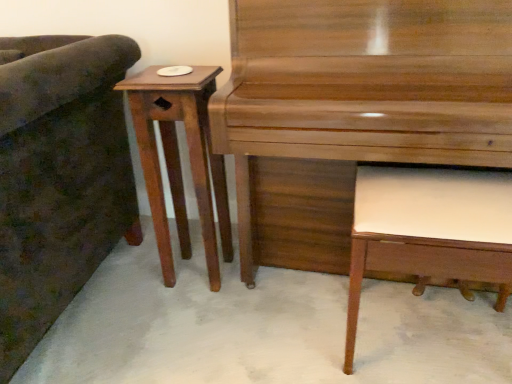
Question: Visually, is shiny brown piano at center positioned to the left or to the right of mahogany wood side table at left?

Choices:
 (A) right
 (B) left

Answer: (A)

Question: From the image's perspective, is shiny brown piano at center positioned above or below mahogany wood side table at left?

Choices:
 (A) below
 (B) above

Answer: (B)

Question: Which of these objects is positioned farthest from the mahogany wood side table at left?

Choices:
 (A) shiny brown piano at center
 (B) white leather music stool at lower right
 (C) dark green fabric couch at left

Answer: (B)

Question: Considering the real-world distances, which object is closest to the dark green fabric couch at left?

Choices:
 (A) shiny brown piano at center
 (B) white leather music stool at lower right
 (C) mahogany wood side table at left

Answer: (C)